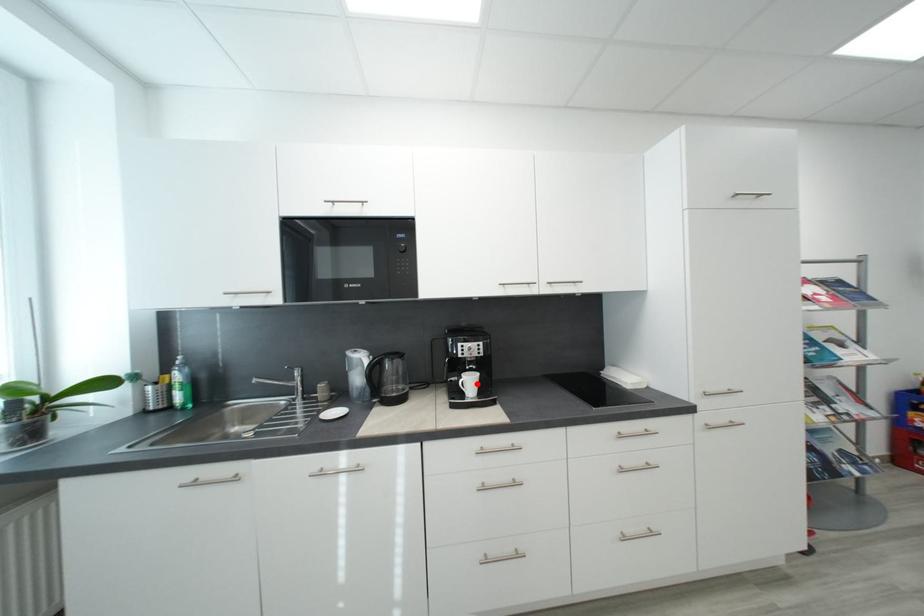
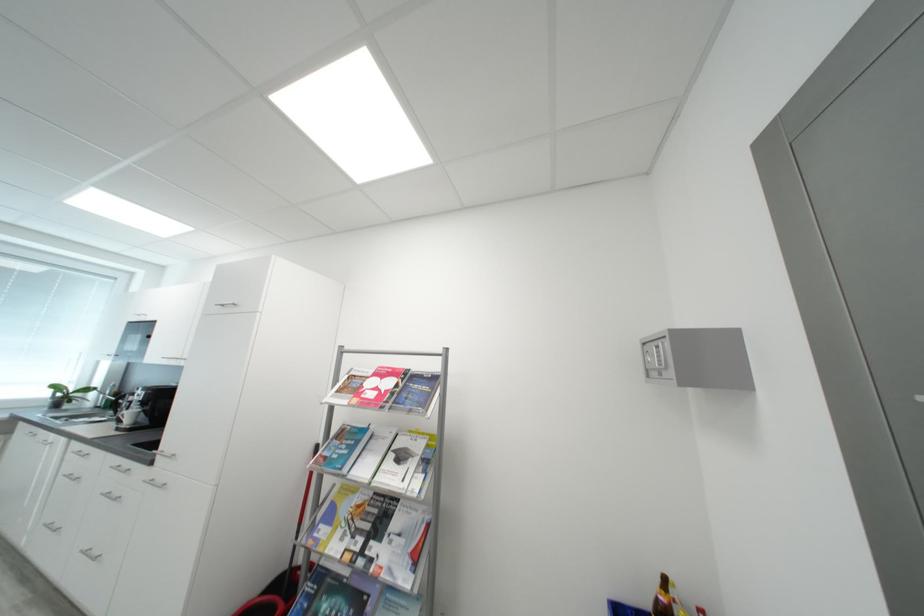
Question: A red point is marked in image1. In image2, is the corresponding 3D point closer to the camera or farther? Reply with the corresponding letter.

Choices:
 (A) The corresponding 3D point is closer.
 (B) The corresponding 3D point is farther.

Answer: (A)